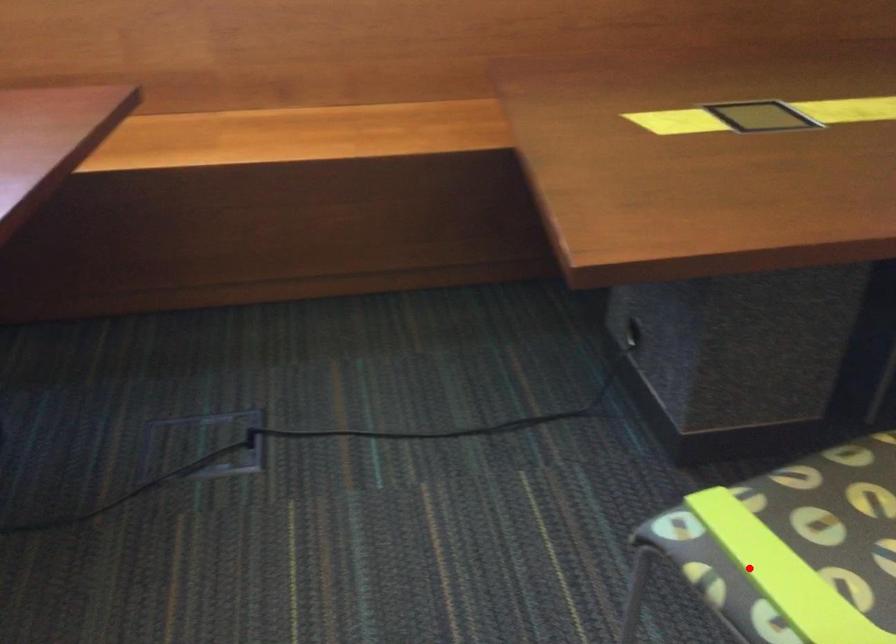
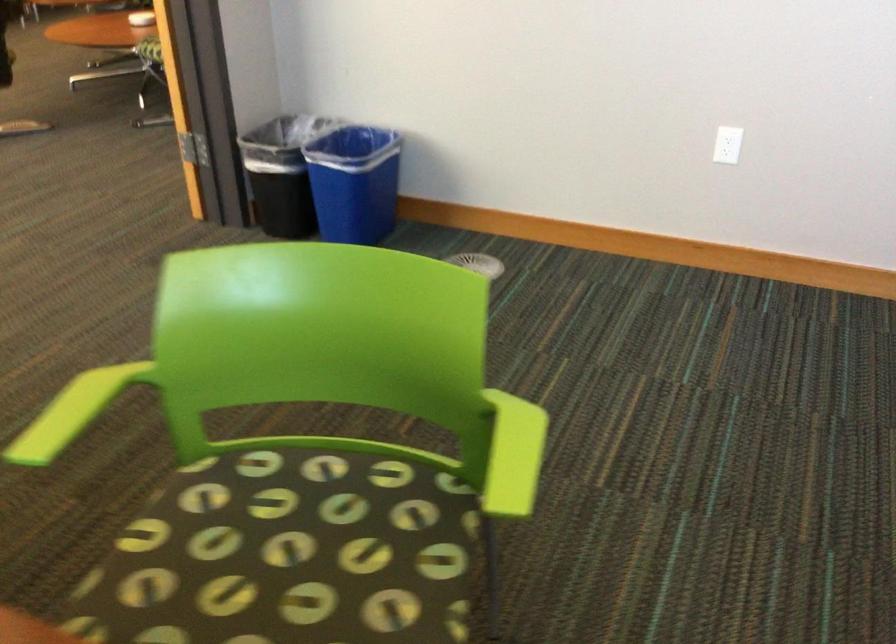
In the second image, find the point that corresponds to the highlighted location in the first image.

(513, 455)